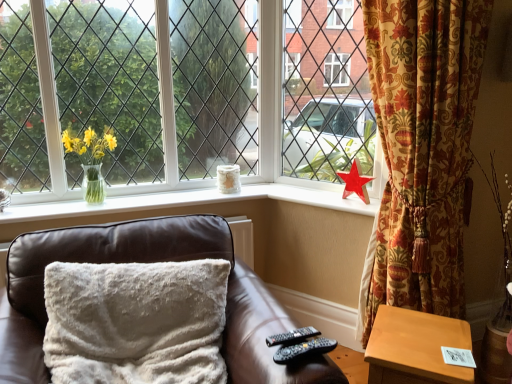
Question: From the image's perspective, would you say matte glass vase at upper center, which ranks as the first daffodil in right-to-left order, is shown under light brown wooden table at lower right?

Choices:
 (A) yes
 (B) no

Answer: (B)

Question: From the image's perspective, is matte glass vase at upper center, which ranks as the first daffodil in right-to-left order, located above light brown wooden table at lower right?

Choices:
 (A) yes
 (B) no

Answer: (A)

Question: Does matte glass vase at upper center, acting as the 2th daffodil starting from the left, have a greater width compared to light brown wooden table at lower right?

Choices:
 (A) no
 (B) yes

Answer: (A)

Question: Considering the relative positions of matte glass vase at upper center, acting as the 2th daffodil starting from the left, and light brown wooden table at lower right in the image provided, is matte glass vase at upper center, acting as the 2th daffodil starting from the left, in front of light brown wooden table at lower right?

Choices:
 (A) yes
 (B) no

Answer: (B)

Question: From a real-world perspective, is matte glass vase at upper center, acting as the 2th daffodil starting from the left, positioned under light brown wooden table at lower right based on gravity?

Choices:
 (A) no
 (B) yes

Answer: (A)

Question: Can you confirm if matte glass vase at upper center, acting as the 2th daffodil starting from the left, is bigger than light brown wooden table at lower right?

Choices:
 (A) yes
 (B) no

Answer: (B)

Question: Can you confirm if light brown wooden table at lower right is taller than gold floral curtain at right?

Choices:
 (A) no
 (B) yes

Answer: (A)

Question: From the image's perspective, would you say light brown wooden table at lower right is shown under gold floral curtain at right?

Choices:
 (A) no
 (B) yes

Answer: (B)

Question: Is light brown wooden table at lower right wider than gold floral curtain at right?

Choices:
 (A) no
 (B) yes

Answer: (A)

Question: Does light brown wooden table at lower right have a lesser height compared to gold floral curtain at right?

Choices:
 (A) yes
 (B) no

Answer: (A)

Question: Does light brown wooden table at lower right appear on the right side of gold floral curtain at right?

Choices:
 (A) yes
 (B) no

Answer: (B)

Question: Is light brown wooden table at lower right turned away from gold floral curtain at right?

Choices:
 (A) yes
 (B) no

Answer: (A)

Question: Could you tell me if matte glass vase at upper center, acting as the 2th daffodil starting from the left, is turned towards brown leather couch at center?

Choices:
 (A) yes
 (B) no

Answer: (A)